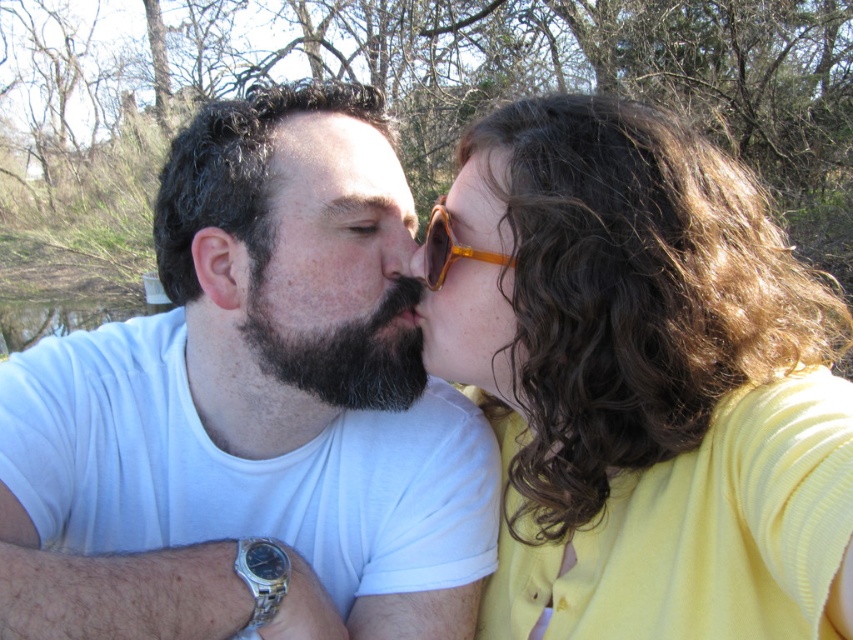
You are an artist trying to sketch the scene. You want to ensure the proportions are accurate. Which object should you draw first, the matte yellow sweater at center or the bearded man at center, considering their sizes?

The matte yellow sweater at center is much taller than the bearded man at center, so you should draw the matte yellow sweater at center first to ensure proper scaling.